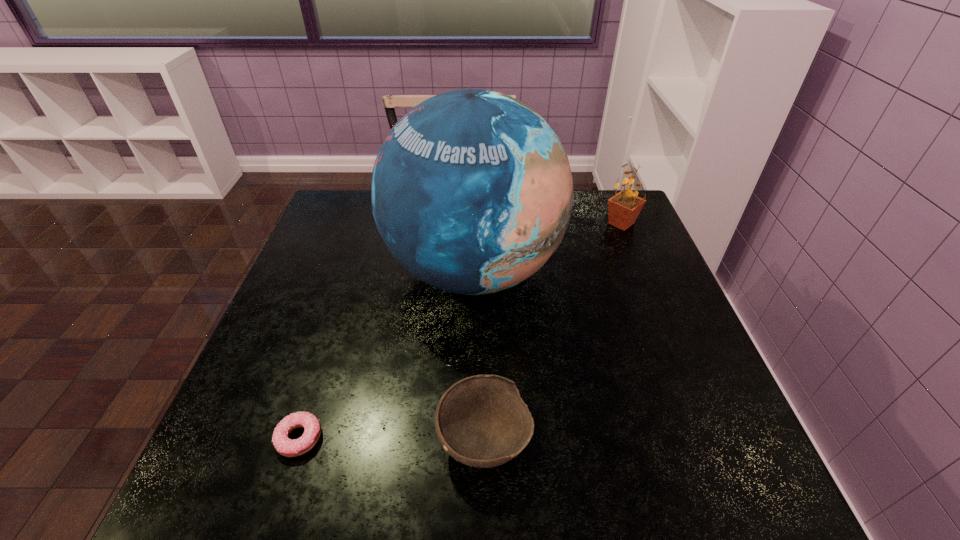
Find the location of a particular element. The image size is (960, 540). the tallest object is located at coordinates (472, 192).

The height and width of the screenshot is (540, 960). In order to click on the rightmost object in this screenshot , I will do `click(623, 209)`.

At what (x,y) coordinates should I click in order to perform the action: click on the second tallest object. Please return your answer as a coordinate pair (x, y). Looking at the image, I should click on (623, 209).

You are a GUI agent. You are given a task and a screenshot of the screen. Output one action in this format:
    pyautogui.click(x=<x>, y=<y>)
    Task: Click on the second shortest object
    The height and width of the screenshot is (540, 960).
    Given the screenshot: What is the action you would take?
    pyautogui.click(x=481, y=421)

This screenshot has width=960, height=540. In order to click on doughnut in this screenshot , I will do `click(287, 447)`.

You are a GUI agent. You are given a task and a screenshot of the screen. Output one action in this format:
    pyautogui.click(x=<x>, y=<y>)
    Task: Click on the leftmost object
    The image size is (960, 540).
    Given the screenshot: What is the action you would take?
    pyautogui.click(x=287, y=447)

At what (x,y) coordinates should I click in order to perform the action: click on vacant area situated on the left of the tallest object. Please return your answer as a coordinate pair (x, y). The width and height of the screenshot is (960, 540). Looking at the image, I should click on (306, 271).

Identify the location of free space located 0.350m at the front of the sunflower with flowers visible. The height and width of the screenshot is (540, 960). (485, 224).

Where is `blank space located 0.280m at the front of the sunflower with flowers visible`? The image size is (960, 540). blank space located 0.280m at the front of the sunflower with flowers visible is located at coordinates (508, 224).

Find the location of a particular element. This screenshot has height=540, width=960. free space located at the front of the sunflower with flowers visible is located at coordinates (488, 224).